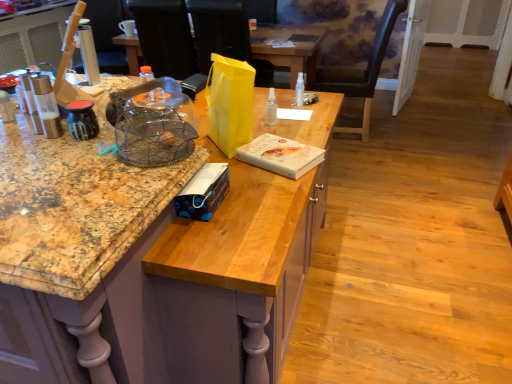
Find the location of a particular element. The width and height of the screenshot is (512, 384). vacant space situated on the left part of matte black kettle at left, the 2th kitchen appliance when ordered from left to right is located at coordinates (31, 142).